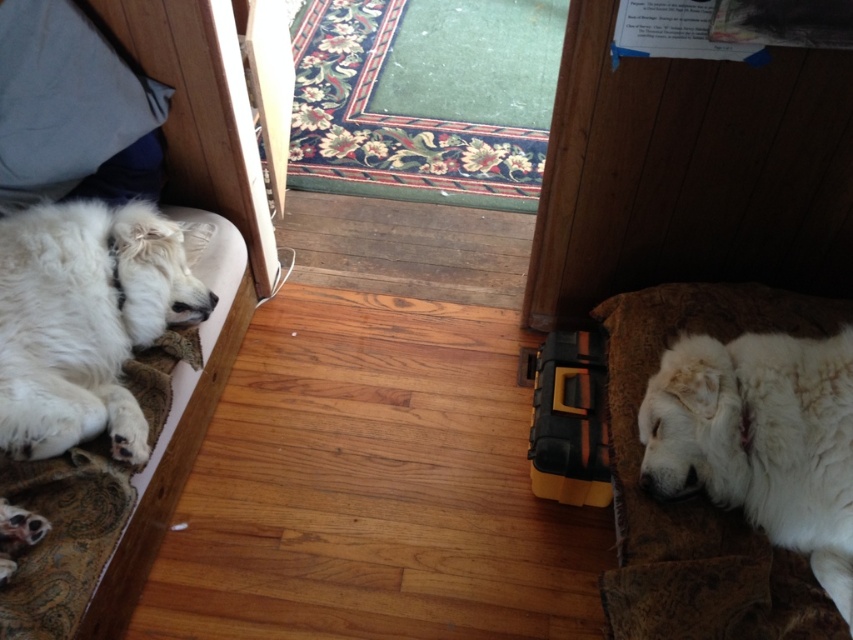
You are a guest in this room and want to find the white fluffy dog at left. You see the white soft bed at left. Which side of the bed should you look towards to find the dog?

The white fluffy dog at left is to the left of the white soft bed at left, so you should look towards the left side of the bed to find the dog.

Looking at this image, you are a small toy that is 1 foot long. You are placed between the white soft bed at left and the white fluffy dog at right. Can you fit entirely between them without overlapping either?

The distance between the white soft bed at left and the white fluffy dog at right is 3.50 feet. Since the toy is only 1 foot long, it can easily fit entirely between them without overlapping either.